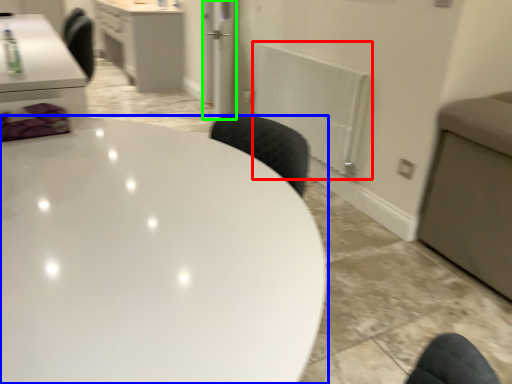
Question: Estimate the real-world distances between objects in this image. Which object is closer to radiator (highlighted by a red box), table (highlighted by a blue box) or glass door (highlighted by a green box)?

Choices:
 (A) table
 (B) glass door

Answer: (B)